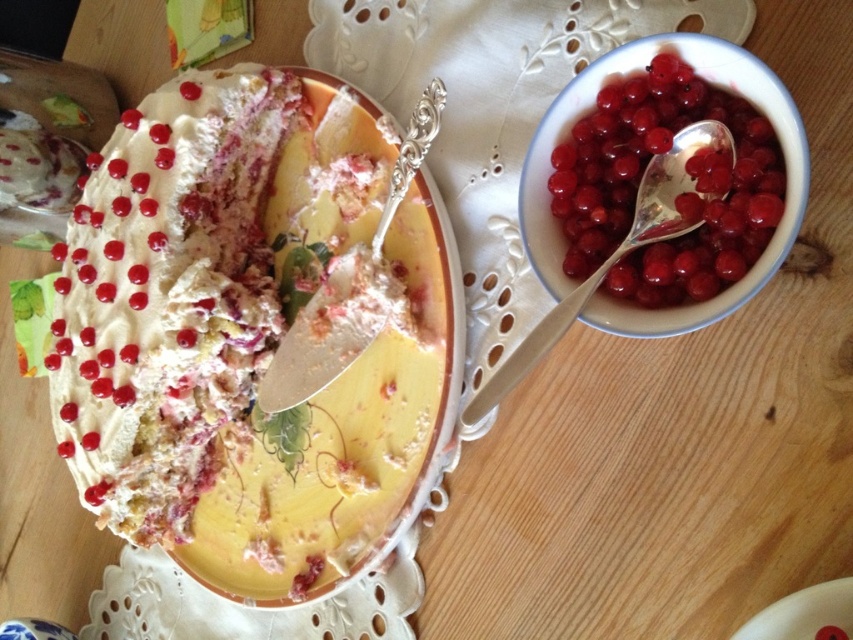
In the scene shown: You are a customer at a bakery and see the porcelain bowl filled with red berries at upper right on the table. You want to place a small chocolate truffle exactly at the coordinates point [590,108]. Is this point located inside the porcelain bowl filled with red berries at upper right?

The point [590,108] corresponds to the porcelain bowl filled with red berries at upper right, so yes, placing the chocolate truffle at that point would place it inside the porcelain bowl filled with red berries at upper right.

You are arranging a dessert table and need to place a silver metallic spoon at upper right next to the porcelain bowl filled with red berries at upper right. According to the image, should you move the spoon to the left or right to align it correctly?

The porcelain bowl filled with red berries at upper right is positioned on the right side of silver metallic spoon at upper right, so to align them correctly, you should move the spoon to the right to place it next to the bowl.